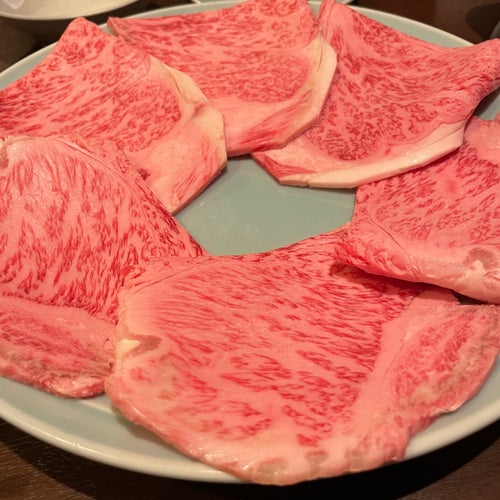
This screenshot has height=500, width=500. Find the location of `part of a white plate/dish in background`. part of a white plate/dish in background is located at coordinates (347, 1).